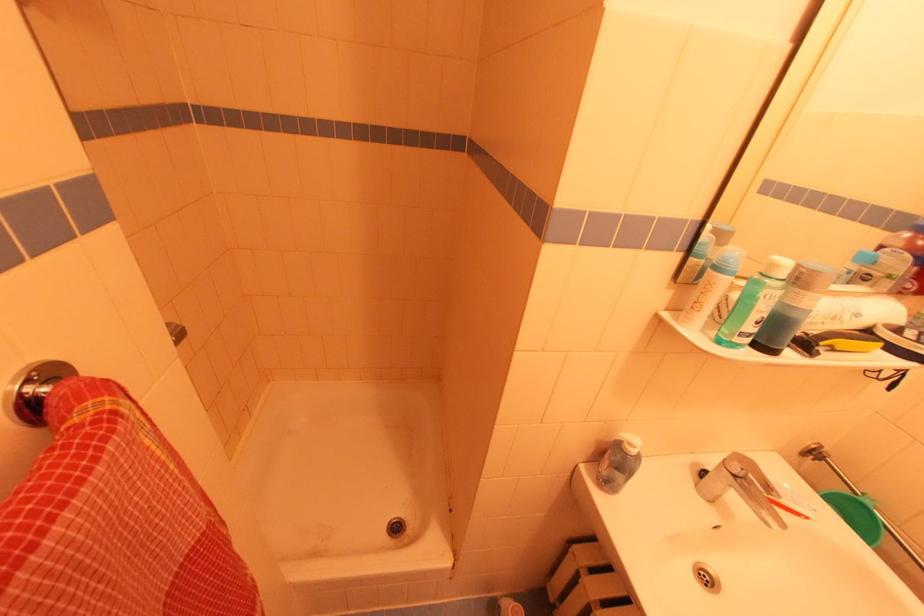
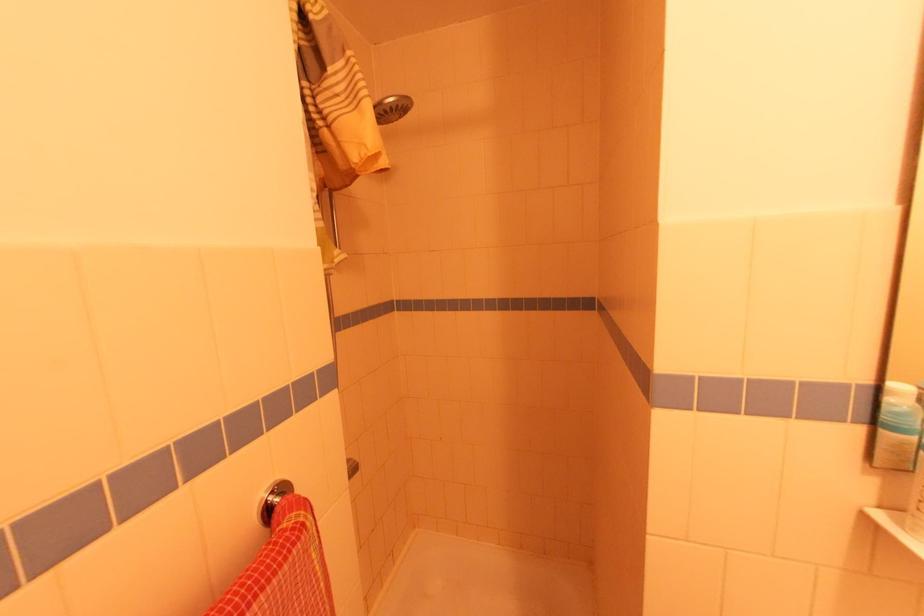
Locate, in the second image, the point that corresponds to point (30, 391) in the first image.

(272, 499)